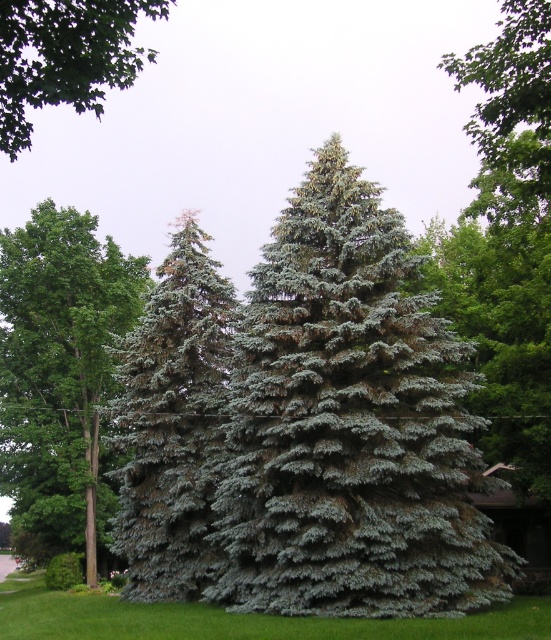
You are standing in front of the Colorado Blue Spruce tree and want to place a small garden ornament. You have two points marked on the lawn where you can place it. The first point is at coordinate point(349,360) and the second is at point(174,624). Which point is closer to you?

Point(349,360) is closer to you because it is further to the viewer than point(174,624).